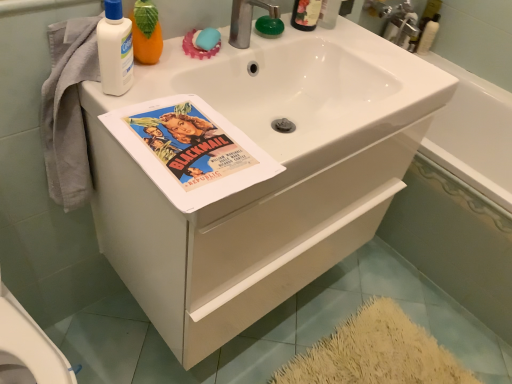
Question: From the image's perspective, is blue rubber soap at upper center above or below white glossy bathtub at upper right, the second bath viewed from the right?

Choices:
 (A) above
 (B) below

Answer: (B)

Question: In the image, is blue rubber soap at upper center on the left side or the right side of white glossy bathtub at upper right, which is the first bath from left to right?

Choices:
 (A) left
 (B) right

Answer: (A)

Question: Estimate the real-world distances between objects in this image. Which object is farther from the translucent plastic bottle at upper right, the 2th cleaning product in the front-to-back sequence?

Choices:
 (A) white matte cabinet at center
 (B) white glossy bathtub at center, the 1th bath in the right-to-left sequence
 (C) matte paper poster at center
 (D) white glossy bathtub at upper right, which is the first bath from left to right
 (E) white matte lotion at upper left, which ranks as the 1th cleaning product in front-to-back order

Answer: (E)

Question: Which object is positioned farthest from the white matte cabinet at center?

Choices:
 (A) matte paper poster at center
 (B) white glossy bathtub at center, the 2th bath viewed from the left
 (C) white glossy bathtub at upper right, which is the first bath from left to right
 (D) white matte lotion at upper left, the second cleaning product from the back
 (E) blue rubber soap at upper center

Answer: (C)